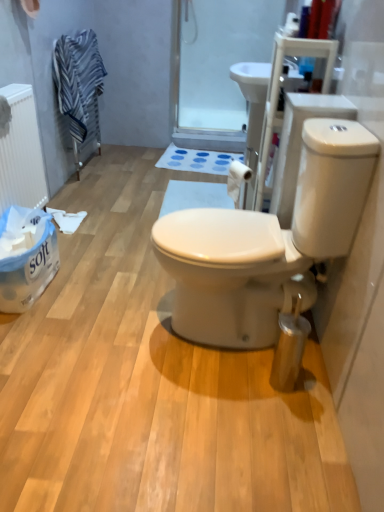
At what (x,y) coordinates should I click in order to perform the action: click on vacant area to the right of white paper towel at lower left. Please return your answer as a coordinate pair (x, y). Looking at the image, I should click on (89, 291).